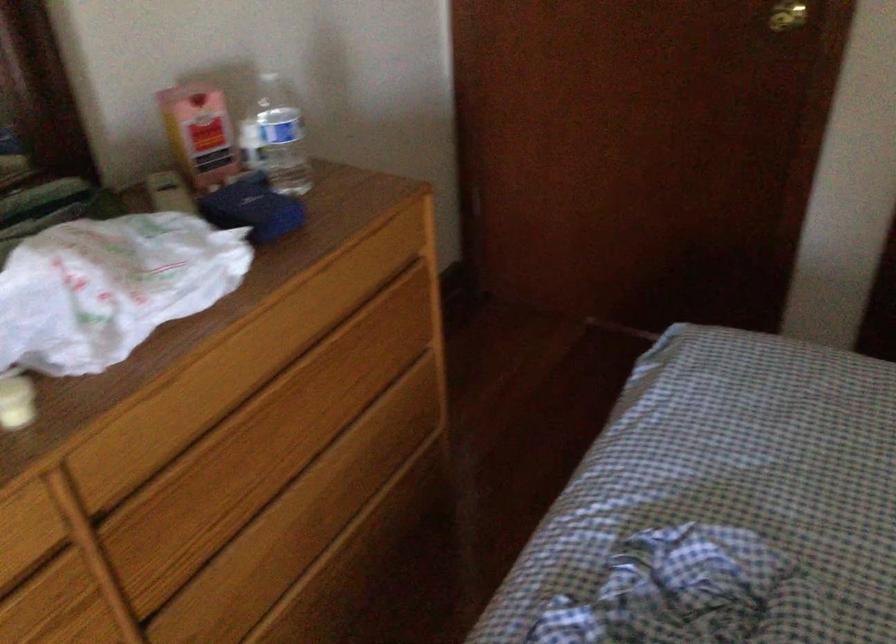
What do you see at coordinates (787, 15) in the screenshot?
I see `a brass doorknob` at bounding box center [787, 15].